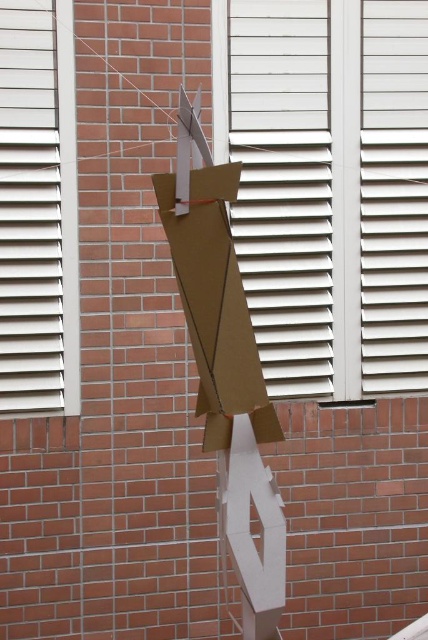
Question: Is white textured window at center in front of white matte window at center?

Choices:
 (A) yes
 (B) no

Answer: (B)

Question: Which object is farther from the camera taking this photo?

Choices:
 (A) brown cardboard at center
 (B) white matte window at center

Answer: (B)

Question: Can you confirm if white matte window at center is smaller than brown cardboard at center?

Choices:
 (A) yes
 (B) no

Answer: (A)

Question: Which point appears farthest from the camera in this image?

Choices:
 (A) (294, 161)
 (B) (0, 266)
 (C) (273, 436)

Answer: (A)

Question: Which point appears farthest from the camera in this image?

Choices:
 (A) (171, 192)
 (B) (50, 346)
 (C) (329, 12)

Answer: (C)

Question: Where is white matte window at center located in relation to brown cardboard at center in the image?

Choices:
 (A) left
 (B) right

Answer: (A)